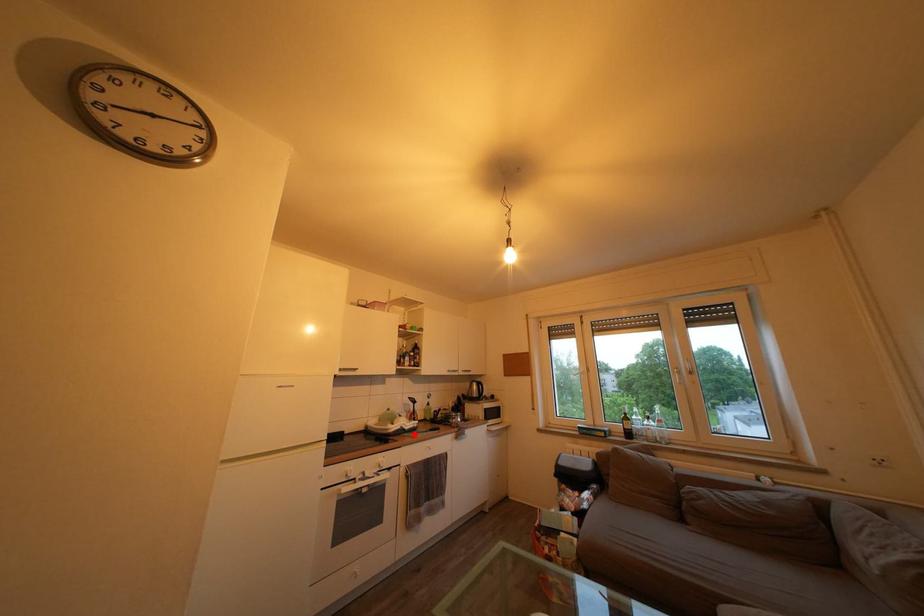
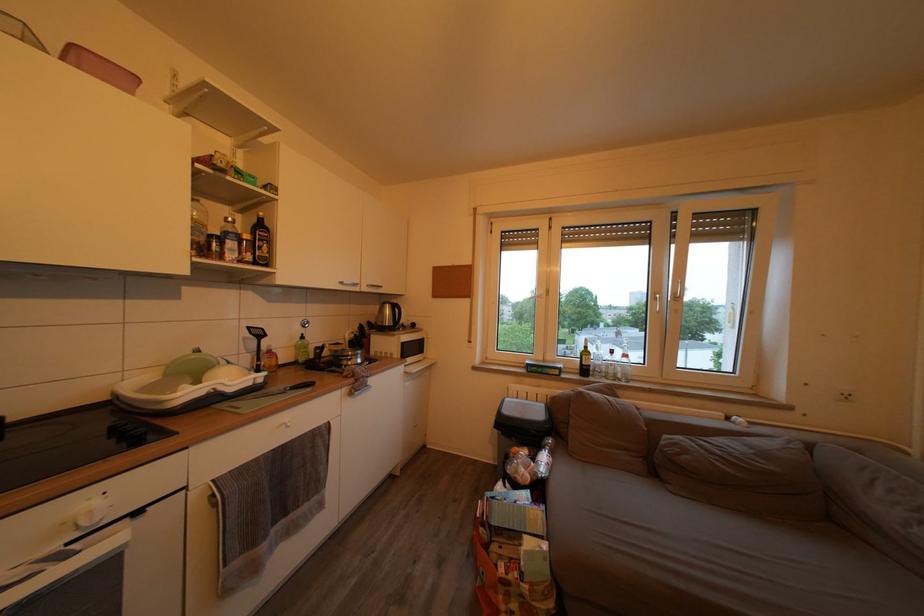
The point at the highlighted location is marked in the first image. Where is the corresponding point in the second image?

(238, 397)